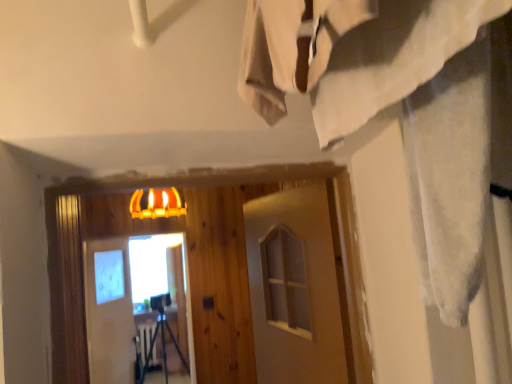
Question: From a real-world perspective, is white matte barn door at center, which is the 2th barn door in right-to-left order, physically located above or below white matte barn door at center, which appears as the second barn door when viewed from the back?

Choices:
 (A) above
 (B) below

Answer: (B)

Question: From their relative heights in the image, would you say white matte barn door at center, which ranks as the first barn door in back-to-front order, is taller or shorter than white matte barn door at center, which is counted as the first barn door, starting from the right?

Choices:
 (A) short
 (B) tall

Answer: (B)

Question: Estimate the real-world distances between objects in this image. Which object is farther from the white matte barn door at center, positioned as the 1th barn door in front-to-back order?

Choices:
 (A) matte glass screen door at center
 (B) yellow matte lamp at upper center
 (C) white matte barn door at center, which ranks as the first barn door in back-to-front order

Answer: (A)

Question: Estimate the real-world distances between objects in this image. Which object is closer to the matte glass screen door at center?

Choices:
 (A) white matte barn door at center, the 1th barn door in the left-to-right sequence
 (B) yellow matte lamp at upper center
 (C) white matte barn door at center, which appears as the second barn door when viewed from the back

Answer: (A)